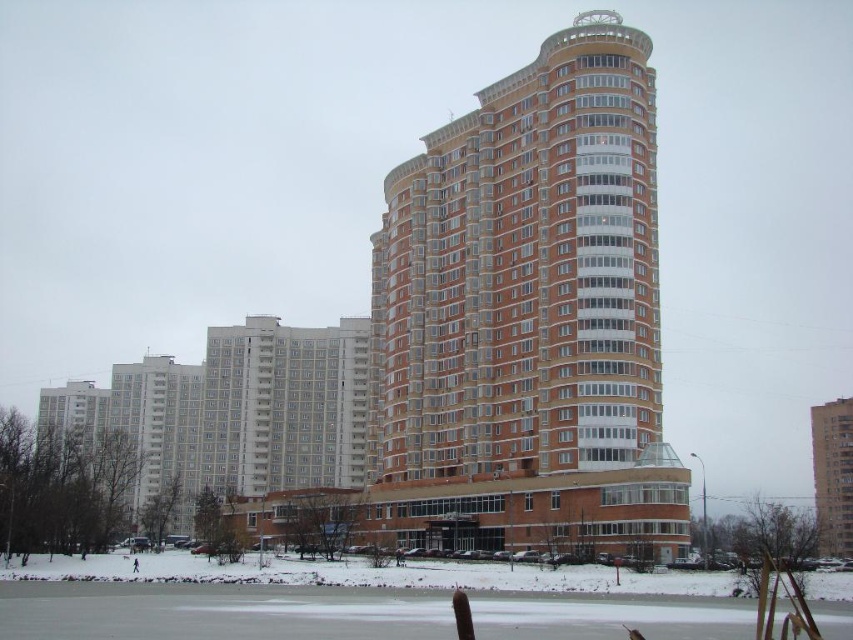
You are a drone operator tasked with flying a drone between the brown brick building at center and the white smooth building at center. The drone has a maximum flight range of 35 meters. Can the drone safely fly between these two buildings without exceeding its range?

The brown brick building at center and white smooth building at center are 36.11 meters apart. Since the drone has a maximum flight range of 35 meters, it cannot safely fly between them without exceeding its range.

From the picture: You are an architect analyzing the urban layout. Based on the scene, which building would require a taller crane for construction, the brown brick building at center or the brick textured building at right?

The brown brick building at center requires a taller crane because it has a greater height compared to the brick textured building at right.

You are standing in the winter urban landscape and want to walk from the frozen body of water to the white smooth building at center. Which direction should you head to avoid the brown brick building at center?

The brown brick building at center is to the right of the white smooth building at center. To avoid it, you should head to the left side of the white smooth building at center.